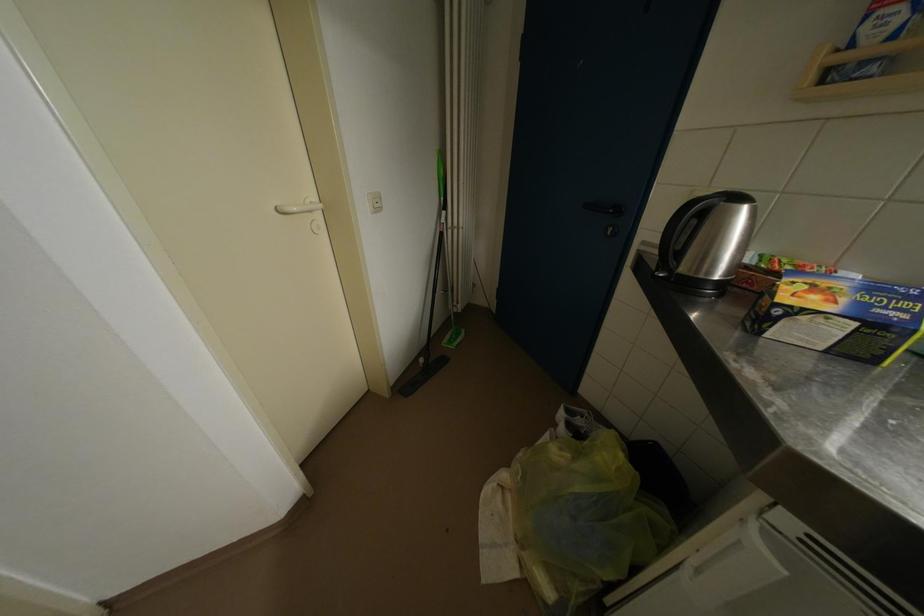
The height and width of the screenshot is (616, 924). What do you see at coordinates (447, 198) in the screenshot? I see `a green mop handle` at bounding box center [447, 198].